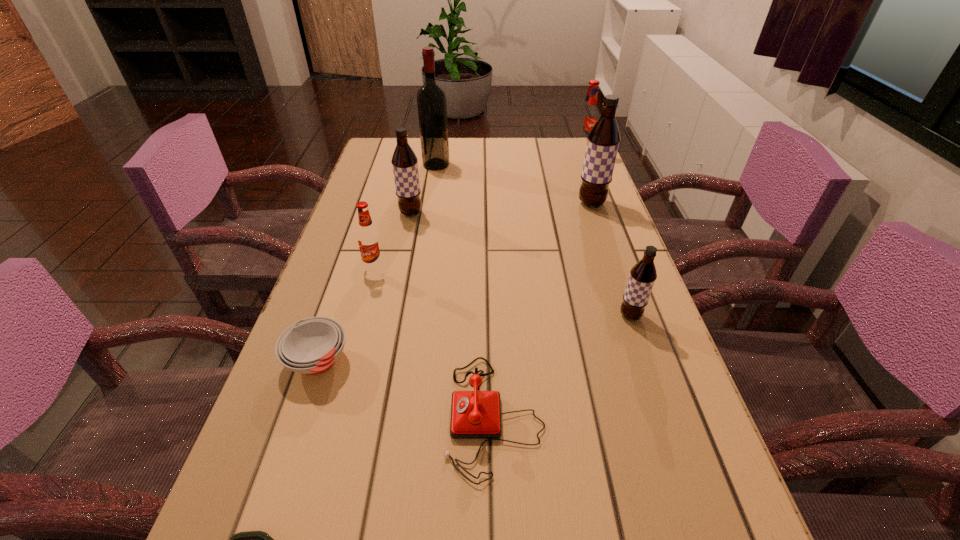
Identify which root beer is the third closest to the ashtray. Please provide its 2D coordinates. Your answer should be formatted as a tuple, i.e. [(x, y)], where the tuple contains the x and y coordinates of a point satisfying the conditions above.

[(404, 161)]

Choose which root beer is the fifth nearest neighbor to the white soup bowl. Please provide its 2D coordinates. Your answer should be formatted as a tuple, i.e. [(x, y)], where the tuple contains the x and y coordinates of a point satisfying the conditions above.

[(588, 116)]

Find the location of `brown root beer that stands as the second closest to the leftmost brown root beer`. brown root beer that stands as the second closest to the leftmost brown root beer is located at coordinates (643, 274).

Locate an element on the screen. The height and width of the screenshot is (540, 960). the second closest brown root beer to the leftmost brown root beer is located at coordinates (643, 274).

Where is `free point that satisfies the following two spatial constraints: 1. on the back side of the second biggest brown root beer; 2. on the right side of the biggest brown root beer`? This screenshot has width=960, height=540. free point that satisfies the following two spatial constraints: 1. on the back side of the second biggest brown root beer; 2. on the right side of the biggest brown root beer is located at coordinates (413, 204).